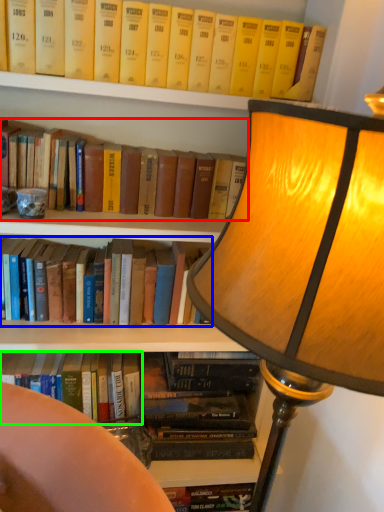
Question: Which object is positioned closest to book (highlighted by a red box)? Select from book (highlighted by a blue box) and book (highlighted by a green box).

Choices:
 (A) book
 (B) book

Answer: (A)